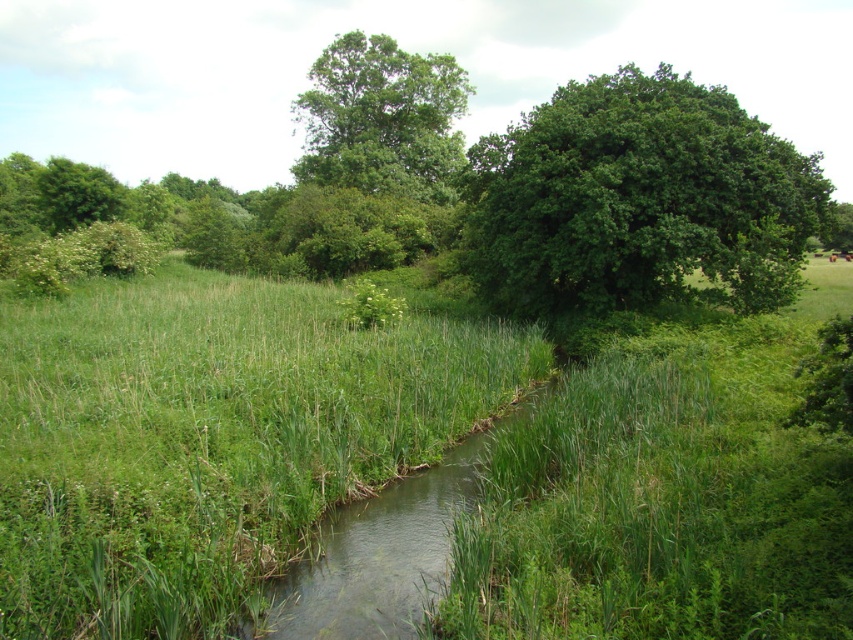
Which is more to the right, green grassy at center or green leafy tree at upper right?

Positioned to the right is green leafy tree at upper right.

Identify the location of green grassy at center. (209, 440).

Can you confirm if green leafy tree at upper right is positioned below green leafy tree at upper center?

No.

Between green leafy tree at upper right and green leafy tree at upper center, which one is positioned higher?

green leafy tree at upper right is above.

Is point (730, 228) in front of point (305, 150)?

Yes, point (730, 228) is in front of point (305, 150).

You are a GUI agent. You are given a task and a screenshot of the screen. Output one action in this format:
    pyautogui.click(x=<x>, y=<y>)
    Task: Click on the green leafy tree at upper right
    This screenshot has height=640, width=853.
    Given the screenshot: What is the action you would take?
    pyautogui.click(x=637, y=198)

Between green grassy at center and green leafy tree at upper center, which one has more height?

Standing taller between the two is green leafy tree at upper center.

Can you confirm if green grassy at center is positioned to the left of green leafy tree at upper center?

Incorrect, green grassy at center is not on the left side of green leafy tree at upper center.

What do you see at coordinates (209, 440) in the screenshot? I see `green grassy at center` at bounding box center [209, 440].

Identify the location of green grassy at center. The image size is (853, 640). (209, 440).